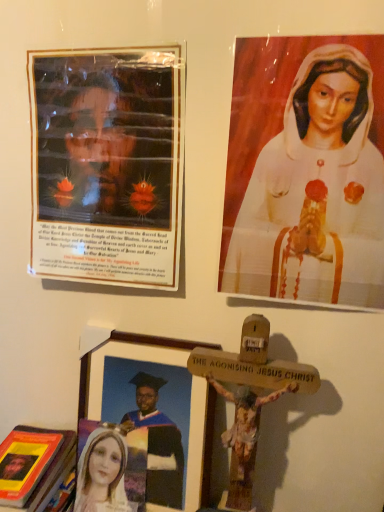
Where is `hardcover book at lower left`? Image resolution: width=384 pixels, height=512 pixels. hardcover book at lower left is located at coordinates (33, 462).

In the scene shown: Does matte plastic poster at upper left, the first picture frame from the top, have a larger size compared to white glossy statue at upper right?

Indeed, matte plastic poster at upper left, the first picture frame from the top, has a larger size compared to white glossy statue at upper right.

Is matte plastic poster at upper left, the first picture frame from the top, positioned behind white glossy statue at upper right?

Yes, matte plastic poster at upper left, the first picture frame from the top, is behind white glossy statue at upper right.

Would you say matte plastic poster at upper left, marked as the 2th picture frame in a bottom-to-top arrangement, is inside or outside white glossy statue at upper right?

matte plastic poster at upper left, marked as the 2th picture frame in a bottom-to-top arrangement, is outside white glossy statue at upper right.

Is white glossy statue at upper right at the back of matte plastic poster at upper left, the first picture frame from the top?

matte plastic poster at upper left, the first picture frame from the top, does not have its back to white glossy statue at upper right.

Considering their positions, is matte plastic poster at upper left, the first picture frame from the top, located in front of or behind hardcover book at lower left?

matte plastic poster at upper left, the first picture frame from the top, is positioned closer to the viewer than hardcover book at lower left.

Is matte plastic poster at upper left, the first picture frame from the top, smaller than hardcover book at lower left?

Yes.

Can you tell me how much matte plastic poster at upper left, marked as the 2th picture frame in a bottom-to-top arrangement, and hardcover book at lower left differ in facing direction?

The facing directions of matte plastic poster at upper left, marked as the 2th picture frame in a bottom-to-top arrangement, and hardcover book at lower left are 2.67 degrees apart.

This screenshot has width=384, height=512. Identify the location of picture frame that is the 2nd one when counting upward from the hardcover book at lower left (from the image's perspective). (107, 165).

Is hardcover book at lower left to the left of matte plastic poster at upper left, the first picture frame from the top, from the viewer's perspective?

Yes.

Can you tell me how much hardcover book at lower left and matte plastic poster at upper left, the first picture frame from the top, differ in facing direction?

The angular difference between hardcover book at lower left and matte plastic poster at upper left, the first picture frame from the top, is 2.67 degrees.

Is hardcover book at lower left not within matte plastic poster at upper left, the first picture frame from the top?

That's correct, hardcover book at lower left is outside of matte plastic poster at upper left, the first picture frame from the top.

Does hardcover book at lower left touch matte plastic poster at upper left, marked as the 2th picture frame in a bottom-to-top arrangement?

hardcover book at lower left and matte plastic poster at upper left, marked as the 2th picture frame in a bottom-to-top arrangement, are not in contact.

Between wooden picture frame at lower center, which is the first picture frame in bottom-to-top order, and white glossy statue at upper right, which one has larger size?

wooden picture frame at lower center, which is the first picture frame in bottom-to-top order.

Does point (172, 358) appear closer or farther from the camera than point (338, 179)?

Clearly, point (172, 358) is more distant from the camera than point (338, 179).

Locate an element on the screen. The height and width of the screenshot is (512, 384). woman positioned vertically above the wooden picture frame at lower center, the second picture frame viewed from the top (from a real-world perspective) is located at coordinates (307, 173).

From the image's perspective, is wooden picture frame at lower center, which is the first picture frame in bottom-to-top order, located beneath white glossy statue at upper right?

Correct, wooden picture frame at lower center, which is the first picture frame in bottom-to-top order, appears lower than white glossy statue at upper right in the image.

How distant is wooden picture frame at lower center, which is the first picture frame in bottom-to-top order, from matte plastic poster at upper left, the first picture frame from the top?

The distance of wooden picture frame at lower center, which is the first picture frame in bottom-to-top order, from matte plastic poster at upper left, the first picture frame from the top, is 11.88 inches.

Does point (196, 429) come in front of point (134, 223)?

No.

How many degrees apart are the facing directions of wooden picture frame at lower center, which is the first picture frame in bottom-to-top order, and matte plastic poster at upper left, marked as the 2th picture frame in a bottom-to-top arrangement?

There is a 0.664-degree angle between the facing directions of wooden picture frame at lower center, which is the first picture frame in bottom-to-top order, and matte plastic poster at upper left, marked as the 2th picture frame in a bottom-to-top arrangement.

Looking at this image, from the image's perspective, is wooden picture frame at lower center, the second picture frame viewed from the top, above matte plastic poster at upper left, the first picture frame from the top?

No.

Considering the sizes of white glossy statue at upper right and hardcover book at lower left in the image, is white glossy statue at upper right taller or shorter than hardcover book at lower left?

Considering their sizes, white glossy statue at upper right has more height than hardcover book at lower left.

From a real-world perspective, who is located lower, white glossy statue at upper right or hardcover book at lower left?

From a 3D spatial view, hardcover book at lower left is below.

Considering the points (339, 46) and (16, 441), which point is behind, point (339, 46) or point (16, 441)?

The point (16, 441) is behind.

Does white glossy statue at upper right contain hardcover book at lower left?

Actually, hardcover book at lower left is outside white glossy statue at upper right.

Does wooden picture frame at lower center, the second picture frame viewed from the top, have a lesser width compared to hardcover book at lower left?

Indeed, wooden picture frame at lower center, the second picture frame viewed from the top, has a lesser width compared to hardcover book at lower left.

In the scene shown: Is wooden picture frame at lower center, which is the first picture frame in bottom-to-top order, aimed at hardcover book at lower left?

No, wooden picture frame at lower center, which is the first picture frame in bottom-to-top order, is not oriented towards hardcover book at lower left.

From the image's perspective, which is above, wooden picture frame at lower center, the second picture frame viewed from the top, or hardcover book at lower left?

wooden picture frame at lower center, the second picture frame viewed from the top.

Is point (81, 392) closer to viewer compared to point (4, 441)?

That is True.

Starting from the white glossy statue at upper right, which picture frame is the 1st one behind? Please provide its 2D coordinates.

[(107, 165)]

This screenshot has height=512, width=384. Find the location of `the 2nd picture frame in front when counting from the hardcover book at lower left`. the 2nd picture frame in front when counting from the hardcover book at lower left is located at coordinates (107, 165).

Looking at the image, which one is located closer to matte plastic poster at upper left, marked as the 2th picture frame in a bottom-to-top arrangement, hardcover book at lower left or wooden picture frame at lower center, the second picture frame viewed from the top?

Based on the image, wooden picture frame at lower center, the second picture frame viewed from the top, appears to be nearer to matte plastic poster at upper left, marked as the 2th picture frame in a bottom-to-top arrangement.

Estimate the real-world distances between objects in this image. Which object is further from wooden picture frame at lower center, which is the first picture frame in bottom-to-top order, white glossy statue at upper right or hardcover book at lower left?

white glossy statue at upper right.

From the image, which object appears to be nearer to wooden picture frame at lower center, which is the first picture frame in bottom-to-top order, hardcover book at lower left or matte plastic poster at upper left, marked as the 2th picture frame in a bottom-to-top arrangement?

The object closer to wooden picture frame at lower center, which is the first picture frame in bottom-to-top order, is hardcover book at lower left.

Considering their positions, is wooden picture frame at lower center, the second picture frame viewed from the top, positioned closer to hardcover book at lower left than white glossy statue at upper right?

wooden picture frame at lower center, the second picture frame viewed from the top, is closer to hardcover book at lower left.

When comparing their distances from white glossy statue at upper right, does wooden picture frame at lower center, the second picture frame viewed from the top, or hardcover book at lower left seem closer?

wooden picture frame at lower center, the second picture frame viewed from the top.

Which object lies nearer to the anchor point matte plastic poster at upper left, marked as the 2th picture frame in a bottom-to-top arrangement, white glossy statue at upper right or wooden picture frame at lower center, the second picture frame viewed from the top?

Among the two, white glossy statue at upper right is located nearer to matte plastic poster at upper left, marked as the 2th picture frame in a bottom-to-top arrangement.

Considering their positions, is white glossy statue at upper right positioned further to hardcover book at lower left than wooden picture frame at lower center, which is the first picture frame in bottom-to-top order?

The object further to hardcover book at lower left is white glossy statue at upper right.

Considering their positions, is hardcover book at lower left positioned closer to white glossy statue at upper right than matte plastic poster at upper left, marked as the 2th picture frame in a bottom-to-top arrangement?

The object closer to white glossy statue at upper right is matte plastic poster at upper left, marked as the 2th picture frame in a bottom-to-top arrangement.

Where is `woman between matte plastic poster at upper left, marked as the 2th picture frame in a bottom-to-top arrangement, and hardcover book at lower left vertically`? The image size is (384, 512). woman between matte plastic poster at upper left, marked as the 2th picture frame in a bottom-to-top arrangement, and hardcover book at lower left vertically is located at coordinates (307, 173).

The height and width of the screenshot is (512, 384). Identify the location of woman between matte plastic poster at upper left, marked as the 2th picture frame in a bottom-to-top arrangement, and wooden picture frame at lower center, the second picture frame viewed from the top, vertically. (307, 173).

This screenshot has height=512, width=384. I want to click on picture frame that lies between white glossy statue at upper right and hardcover book at lower left from top to bottom, so click(123, 356).

The height and width of the screenshot is (512, 384). Identify the location of picture frame between matte plastic poster at upper left, the first picture frame from the top, and hardcover book at lower left in the up-down direction. (123, 356).